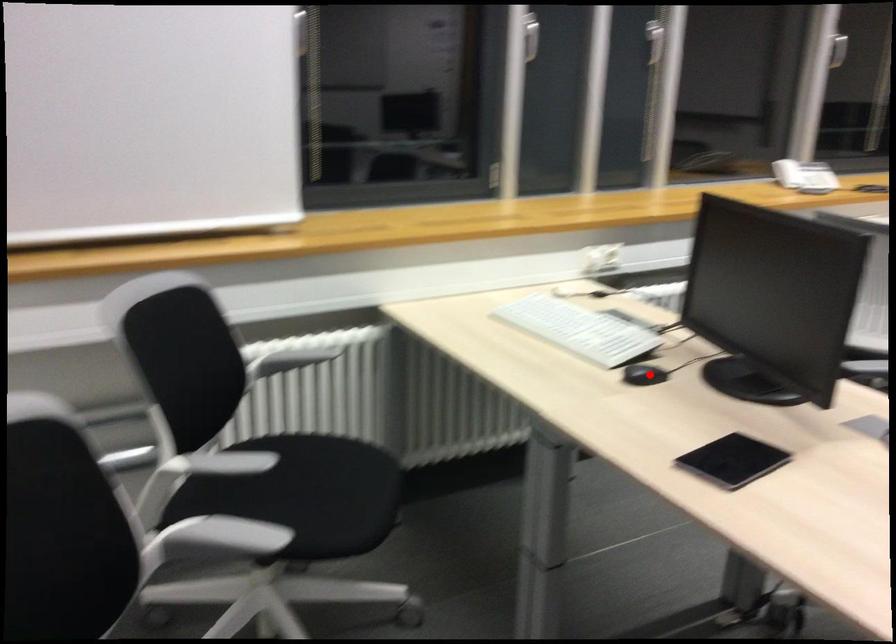
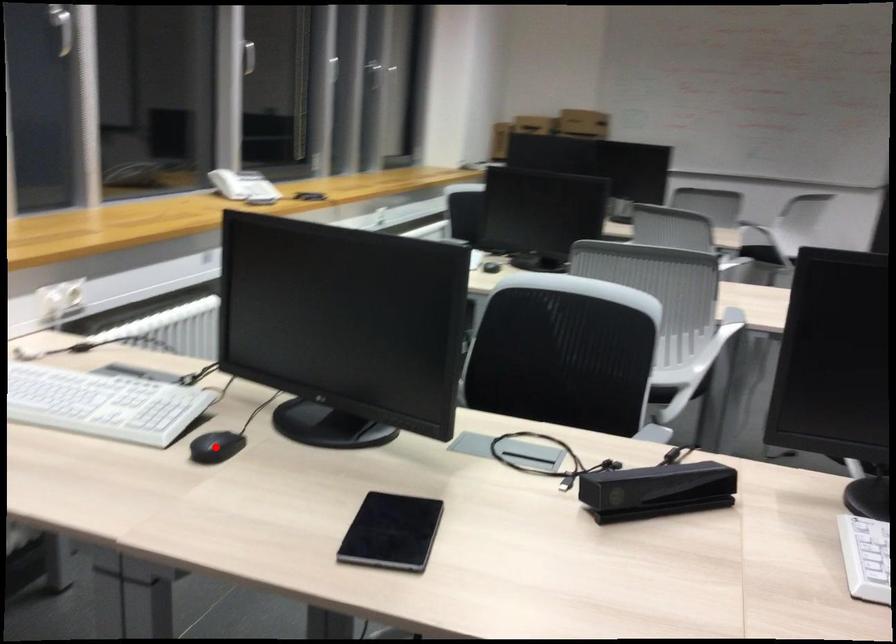
I am providing you with two images of the same scene from different viewpoints. A red point is marked on the first image and another point is marked on the second image. Do the highlighted points in image1 and image2 indicate the same real-world spot?

Yes